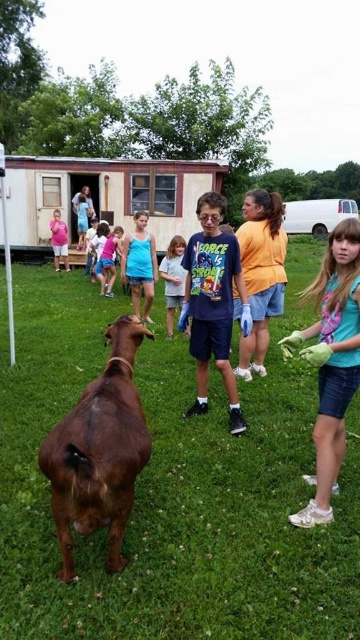
You are standing in the grassy area and see two points marked in the scene. Which point is closer to you, point (x=222, y=531) or point (x=82, y=504)?

Point (x=222, y=531) is closer to you because it is further to the viewer than point (x=82, y=504).

You are standing in the grassy area where the group is gathered around the brown goat. You see a point labeled with coordinates. What object is located at point (331,362)?

The point (331,362) indicates the location of the light blue t shirt at center.